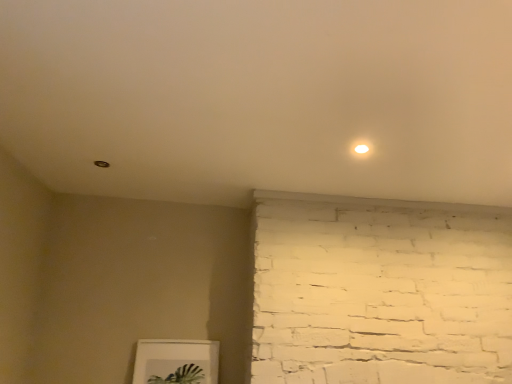
What do you see at coordinates (175, 358) in the screenshot?
I see `white matte picture frame at lower center` at bounding box center [175, 358].

Identify the location of white matte picture frame at lower center. The height and width of the screenshot is (384, 512). (175, 358).

The width and height of the screenshot is (512, 384). Identify the location of white matte light at upper right. (361, 148).

What is the approximate width of white matte light at upper right?

white matte light at upper right is 8.45 centimeters wide.

Image resolution: width=512 pixels, height=384 pixels. What do you see at coordinates (361, 148) in the screenshot? I see `white matte light at upper right` at bounding box center [361, 148].

The height and width of the screenshot is (384, 512). I want to click on white matte picture frame at lower center, so click(x=175, y=358).

Is white matte picture frame at lower center at the left side of white matte light at upper right?

Yes.

Does white matte picture frame at lower center come in front of white matte light at upper right?

No, the depth of white matte picture frame at lower center is greater than that of white matte light at upper right.

Which is nearer, (162, 372) or (364, 146)?

Point (162, 372) is farther from the camera than point (364, 146).

From the image's perspective, is white matte picture frame at lower center positioned above or below white matte light at upper right?

white matte picture frame at lower center is situated lower than white matte light at upper right in the image.

From a real-world perspective, is white matte picture frame at lower center positioned under white matte light at upper right based on gravity?

Indeed, from a real-world perspective, white matte picture frame at lower center is positioned beneath white matte light at upper right.

In the scene shown: Which of these two, white matte picture frame at lower center or white matte light at upper right, is wider?

Wider between the two is white matte picture frame at lower center.

Between white matte picture frame at lower center and white matte light at upper right, which one has more height?

white matte picture frame at lower center.

Does white matte picture frame at lower center have a larger size compared to white matte light at upper right?

Correct, white matte picture frame at lower center is larger in size than white matte light at upper right.

Can white matte light at upper right be found inside white matte picture frame at lower center?

No, white matte light at upper right is located outside of white matte picture frame at lower center.

Would you say white matte picture frame at lower center is a long distance from white matte light at upper right?

Yes, white matte picture frame at lower center and white matte light at upper right are quite far apart.

Is white matte picture frame at lower center aimed at white matte light at upper right?

No, white matte picture frame at lower center is not oriented towards white matte light at upper right.

Can you tell me how much white matte picture frame at lower center and white matte light at upper right differ in facing direction?

There is a 0.936-degree angle between the facing directions of white matte picture frame at lower center and white matte light at upper right.

How much distance is there between white matte picture frame at lower center and white matte light at upper right?

white matte picture frame at lower center is 5.79 feet from white matte light at upper right.

Locate an element on the screen. This screenshot has width=512, height=384. picture frame below the white matte light at upper right (from a real-world perspective) is located at coordinates (175, 358).

Is white matte light at upper right to the right of white matte picture frame at lower center from the viewer's perspective?

Yes.

Considering the positions of objects white matte light at upper right and white matte picture frame at lower center in the image provided, who is in front, white matte light at upper right or white matte picture frame at lower center?

white matte light at upper right.

Which is behind, point (368, 149) or point (211, 358)?

The point (211, 358) is farther from the camera.

In the scene shown: From the image's perspective, is white matte light at upper right over white matte picture frame at lower center?

Yes, from the image's perspective, white matte light at upper right is over white matte picture frame at lower center.

In the scene shown: From a real-world perspective, between white matte light at upper right and white matte picture frame at lower center, who is vertically higher?

white matte light at upper right is physically above.

From the picture: Is white matte light at upper right thinner than white matte picture frame at lower center?

Indeed, white matte light at upper right has a lesser width compared to white matte picture frame at lower center.

In terms of height, does white matte light at upper right look taller or shorter compared to white matte picture frame at lower center?

In the image, white matte light at upper right appears to be shorter than white matte picture frame at lower center.

Is white matte light at upper right bigger or smaller than white matte picture frame at lower center?

white matte light at upper right is smaller than white matte picture frame at lower center.

Could white matte picture frame at lower center be considered to be inside white matte light at upper right?

No, white matte picture frame at lower center is not surrounded by white matte light at upper right.

Is white matte light at upper right far away from white matte picture frame at lower center?

Yes, white matte light at upper right and white matte picture frame at lower center are located far from each other.

Is white matte light at upper right facing away from white matte picture frame at lower center?

white matte light at upper right is not turned away from white matte picture frame at lower center.

How many degrees apart are the facing directions of white matte light at upper right and white matte picture frame at lower center?

There is a 0.936-degree angle between the facing directions of white matte light at upper right and white matte picture frame at lower center.

How far apart are white matte light at upper right and white matte picture frame at lower center?

A distance of 1.76 meters exists between white matte light at upper right and white matte picture frame at lower center.

What are the coordinates of `picture frame located underneath the white matte light at upper right (from a real-world perspective)` in the screenshot? It's located at (175, 358).

The height and width of the screenshot is (384, 512). What are the coordinates of `light positioned vertically above the white matte picture frame at lower center (from a real-world perspective)` in the screenshot? It's located at pyautogui.click(x=361, y=148).

This screenshot has width=512, height=384. In the image, there is a white matte light at upper right. Identify the location of picture frame below it (from a real-world perspective). (175, 358).